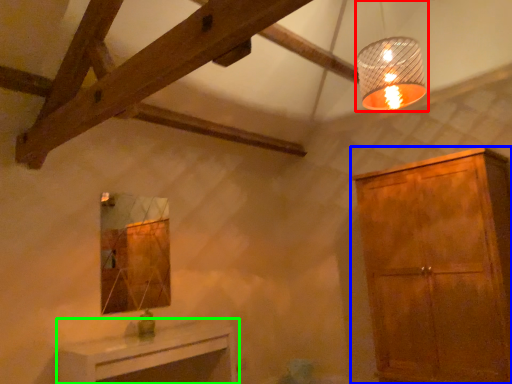
Question: Which is nearer to the lamp (highlighted by a red box)? cabinetry (highlighted by a blue box) or table (highlighted by a green box).

Choices:
 (A) cabinetry
 (B) table

Answer: (A)